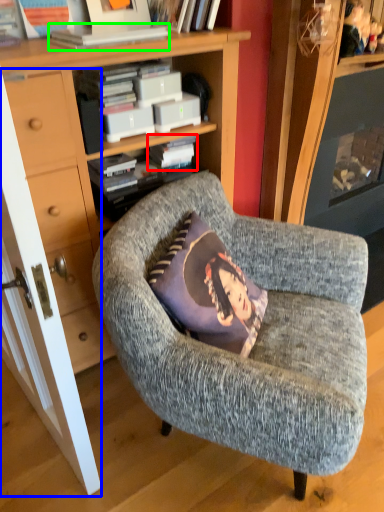
Question: Based on their relative distances, which object is nearer to paperback book (highlighted by a red box)? Choose from door (highlighted by a blue box) and book (highlighted by a green box).

Choices:
 (A) door
 (B) book

Answer: (B)